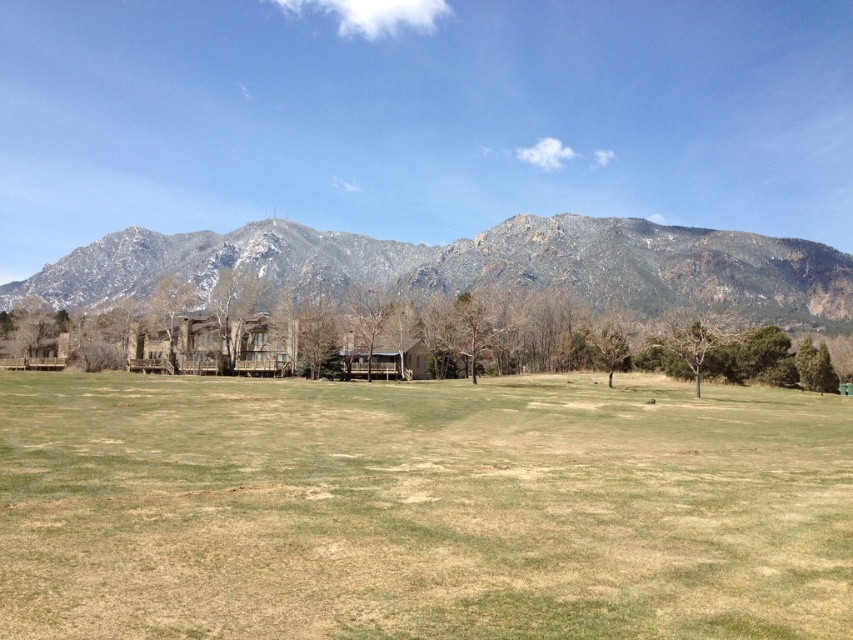
Question: Is green grassy field at center bigger than rocky gray mountain range at upper center?

Choices:
 (A) no
 (B) yes

Answer: (A)

Question: Which object is closer to the camera taking this photo?

Choices:
 (A) rocky gray mountain range at upper center
 (B) green leafy tree at center
 (C) wooden cabin at center
 (D) brown textured tree at center

Answer: (B)

Question: Considering the relative positions of wooden cabin at center and brown textured tree at center in the image provided, where is wooden cabin at center located with respect to brown textured tree at center?

Choices:
 (A) right
 (B) left

Answer: (B)

Question: Is wooden cabin at center positioned at the back of brown textured tree at center?

Choices:
 (A) no
 (B) yes

Answer: (B)

Question: Which is farther from the green grassy field at center?

Choices:
 (A) green leafy tree at center
 (B) rocky gray mountain range at upper center
 (C) brown textured tree at center

Answer: (B)

Question: Which of the following is the closest to the observer?

Choices:
 (A) green grassy field at center
 (B) brown textured tree at center

Answer: (A)